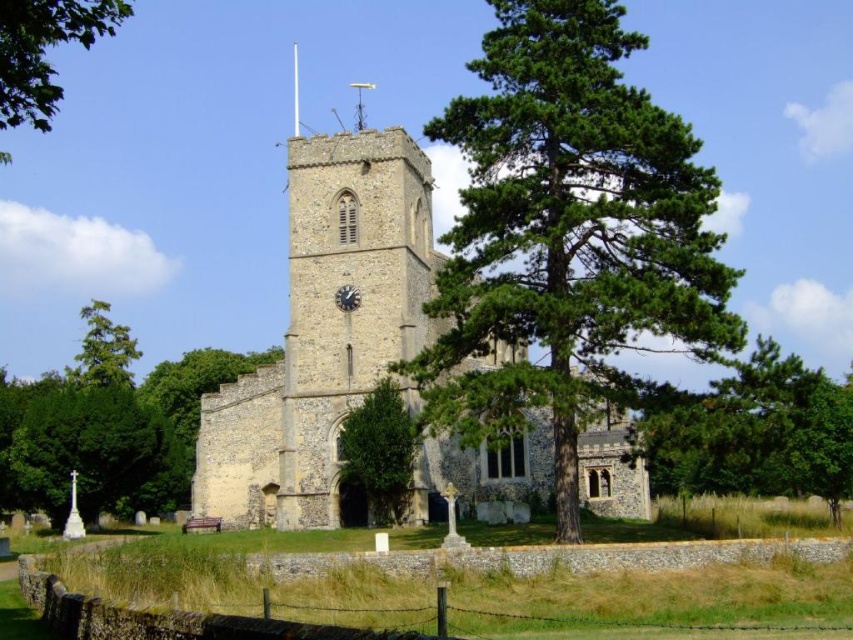
Question: Can you confirm if green leafy tree at upper left is wider than green leafy tree at center?

Choices:
 (A) yes
 (B) no

Answer: (A)

Question: Based on their relative distances, which object is nearer to the green textured pine tree at center?

Choices:
 (A) green leafy tree at center
 (B) green leafy tree at upper left

Answer: (A)

Question: Is green leafy tree at lower left smaller than green leafy tree at center?

Choices:
 (A) no
 (B) yes

Answer: (A)

Question: Based on their relative distances, which object is farther from the green textured pine tree at center?

Choices:
 (A) green textured pine tree at left
 (B) green leafy tree at upper left

Answer: (A)

Question: Which object is the closest to the stone church at center?

Choices:
 (A) green textured pine tree at left
 (B) green leafy tree at lower left
 (C) green textured tree at right
 (D) green textured pine tree at center

Answer: (D)

Question: Does green textured pine tree at center have a greater width compared to green textured tree at right?

Choices:
 (A) no
 (B) yes

Answer: (A)